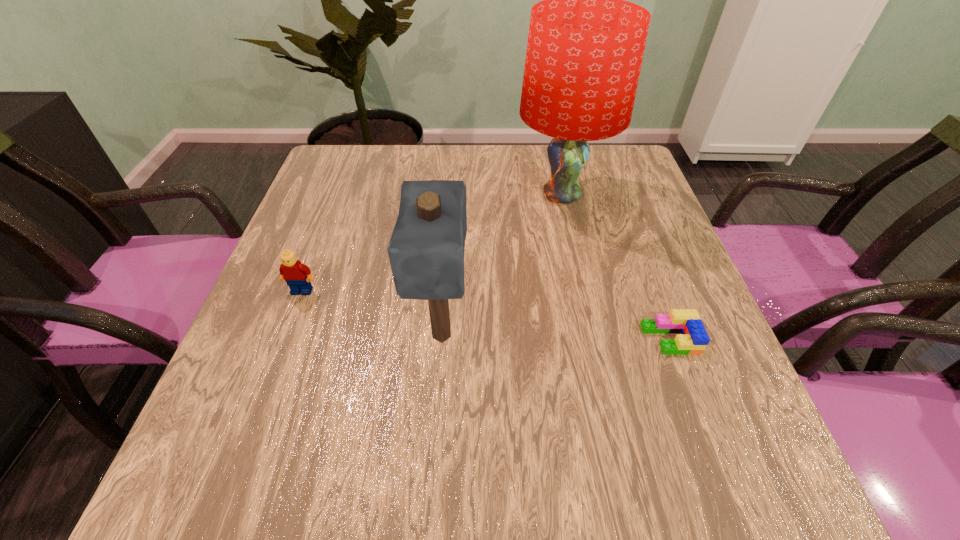
At what (x,y) coordinates should I click in order to perform the action: click on free space at the right edge of the desktop. Please return your answer as a coordinate pair (x, y). Looking at the image, I should click on (640, 349).

You are a GUI agent. You are given a task and a screenshot of the screen. Output one action in this format:
    pyautogui.click(x=<x>, y=<y>)
    Task: Click on the vacant space at the far left corner
    
    Given the screenshot: What is the action you would take?
    pyautogui.click(x=333, y=146)

The image size is (960, 540). In the image, there is a desktop. In order to click on free space at the near left corner in this screenshot , I will do `click(204, 451)`.

The width and height of the screenshot is (960, 540). In the image, there is a desktop. What are the coordinates of `free space at the near right corner` in the screenshot? It's located at (735, 471).

This screenshot has height=540, width=960. I want to click on free point between the shorter Lego and the third object from right to left, so click(556, 337).

Identify the location of vacant area between the tallest object and the second tallest object. The height and width of the screenshot is (540, 960). (502, 265).

Find the location of a particular element. This screenshot has width=960, height=540. free space between the mallet and the shorter Lego is located at coordinates (556, 337).

Find the location of `vacant space that is in between the farther Lego and the shortest object`. vacant space that is in between the farther Lego and the shortest object is located at coordinates (486, 315).

In order to click on free spot between the third tallest object and the third object from right to left in this screenshot , I will do `click(372, 313)`.

The width and height of the screenshot is (960, 540). In order to click on vacant space in between the second tallest object and the taller Lego in this screenshot , I will do `click(372, 313)`.